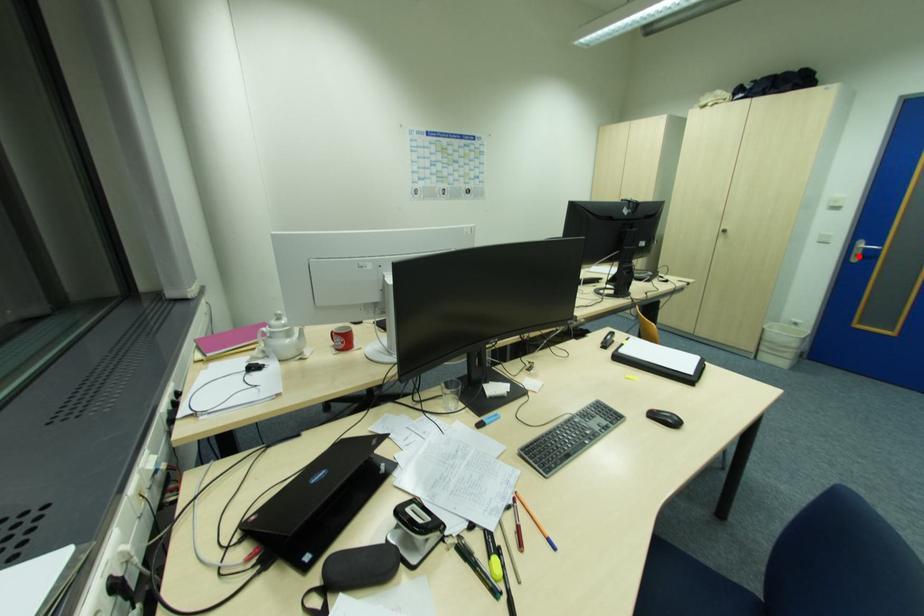
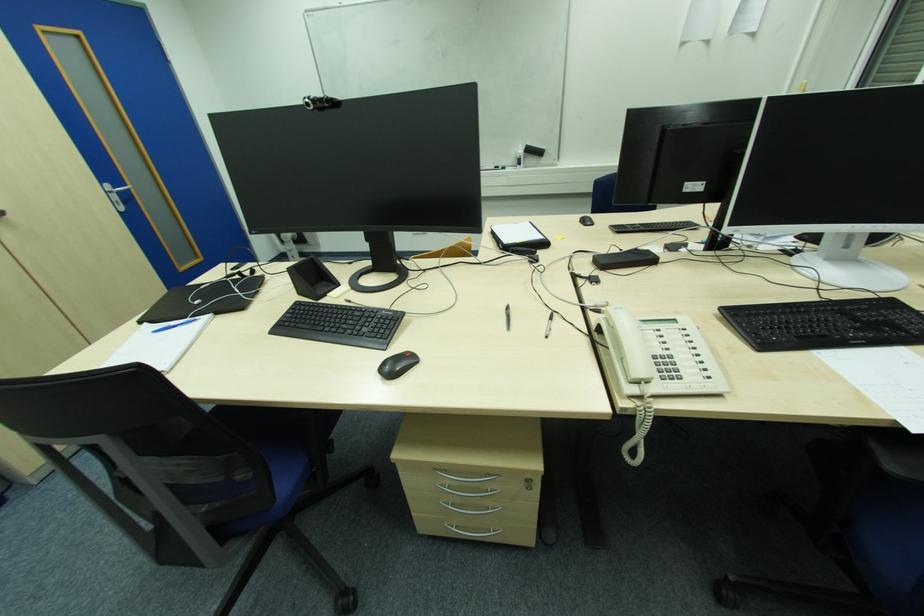
Where in the second image is the point corresponding to the highlighted location from the first image?

(119, 204)